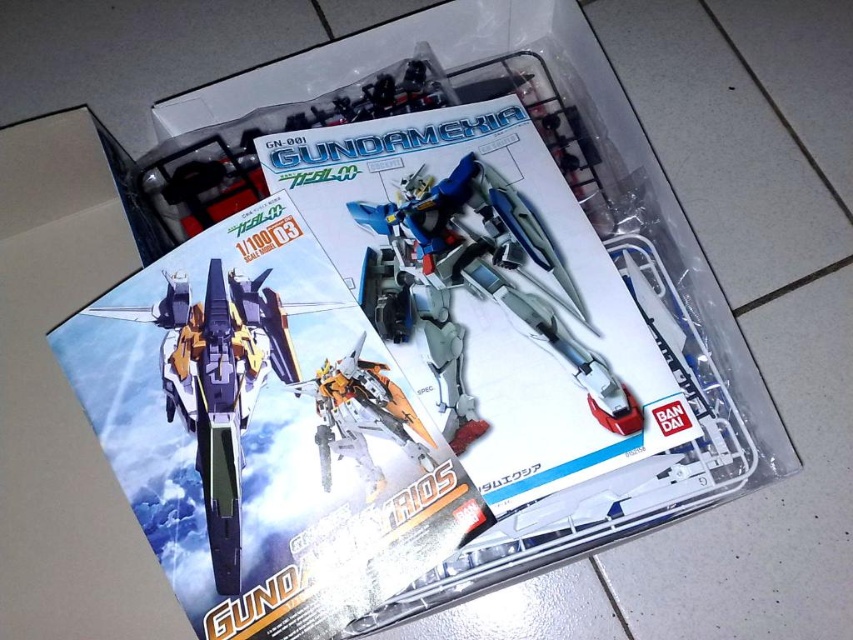
You are a model kit collector who wants to display both the matte silver fighter jet at center and the metallic silver robot at center on a shelf. Given their sizes, which one will require more vertical space?

The matte silver fighter jet at center requires more vertical space because it is much taller than the metallic silver robot at center.

You are a collector who wants to display both the matte silver fighter jet at center and the metallic silver robot at center from the Gundam model kit box. Based on the image, which object should be placed to the left if you want to replicate the packaging layout?

The matte silver fighter jet at center should be placed to the left of the metallic silver robot at center to match the packaging layout.

You are a model kit collector who wants to display both the matte silver fighter jet at center and the metallic silver robot at center on a shelf. Given their sizes, which one will require more space on the shelf?

The matte silver fighter jet at center is bigger than the metallic silver robot at center, so it will require more space on the shelf.